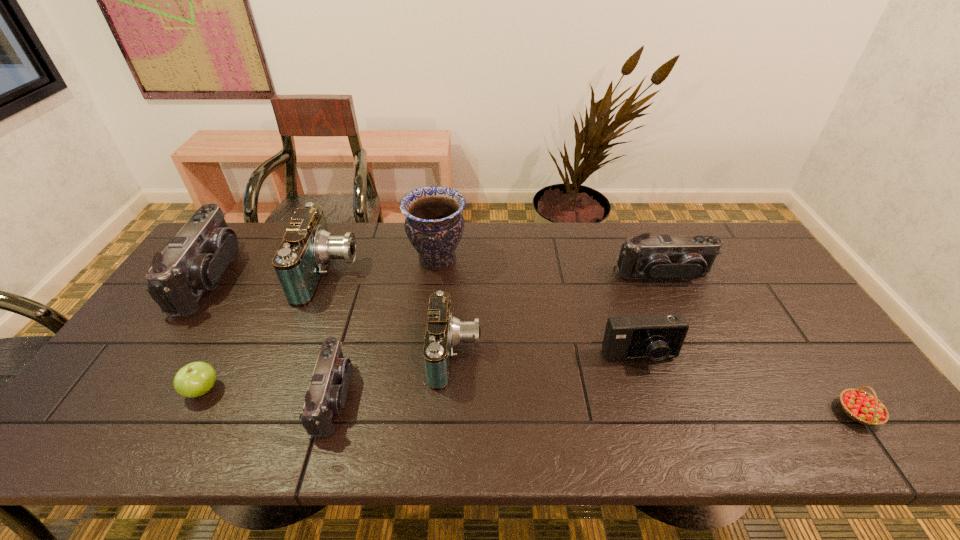
Find the location of a particular element. The width and height of the screenshot is (960, 540). vacant space that is in between the left blue camcorder and the right blue camcorder is located at coordinates (392, 313).

Locate an element on the screen. This screenshot has height=540, width=960. free area in between the shortest object and the leftmost object is located at coordinates (534, 345).

Where is `free space between the smaller blue camcorder and the biggest black camcorder`? The width and height of the screenshot is (960, 540). free space between the smaller blue camcorder and the biggest black camcorder is located at coordinates point(333,316).

This screenshot has width=960, height=540. Identify the location of free space between the camera and the smallest black camcorder. (487, 377).

The width and height of the screenshot is (960, 540). What are the coordinates of `free space between the second smallest black camcorder and the strawberry` in the screenshot? It's located at (760, 343).

Where is `blank region between the eighth object from right to left and the camera`? blank region between the eighth object from right to left and the camera is located at coordinates (421, 374).

Select which object is the eighth closest to the nearest black camcorder. Please provide its 2D coordinates. Your answer should be formatted as a tuple, i.e. [(x, y)], where the tuple contains the x and y coordinates of a point satisfying the conditions above.

[(862, 407)]

Identify which object is the seventh nearest to the leftmost camcorder. Please provide its 2D coordinates. Your answer should be formatted as a tuple, i.e. [(x, y)], where the tuple contains the x and y coordinates of a point satisfying the conditions above.

[(687, 257)]

Locate which camcorder ranks in proximity to the leftmost black camcorder. Please provide its 2D coordinates. Your answer should be formatted as a tuple, i.e. [(x, y)], where the tuple contains the x and y coordinates of a point satisfying the conditions above.

[(300, 262)]

Identify the location of the closest camcorder to the second smallest black camcorder. This screenshot has width=960, height=540. (444, 331).